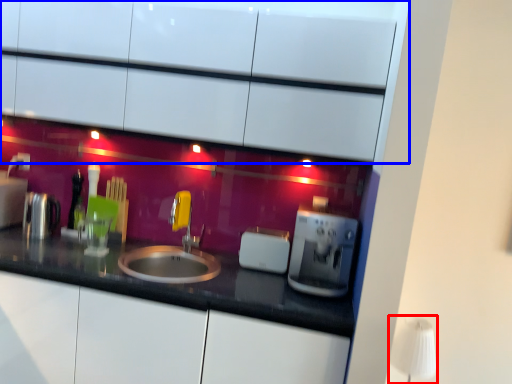
Question: Among these objects, which one is nearest to the camera, table lamp (highlighted by a red box) or cabinetry (highlighted by a blue box)?

Choices:
 (A) table lamp
 (B) cabinetry

Answer: (B)